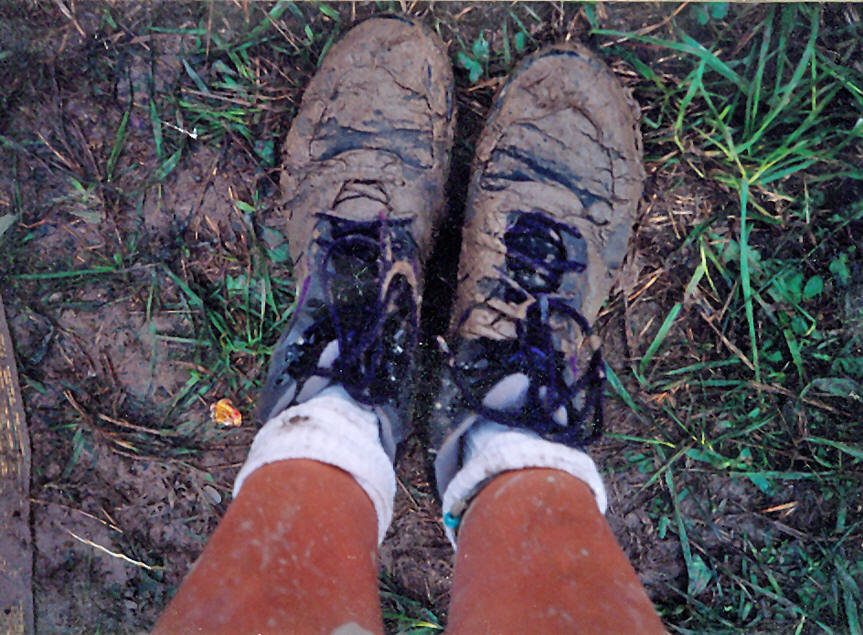
The width and height of the screenshot is (863, 635). Find the location of `sock`. sock is located at coordinates (320, 432), (498, 453).